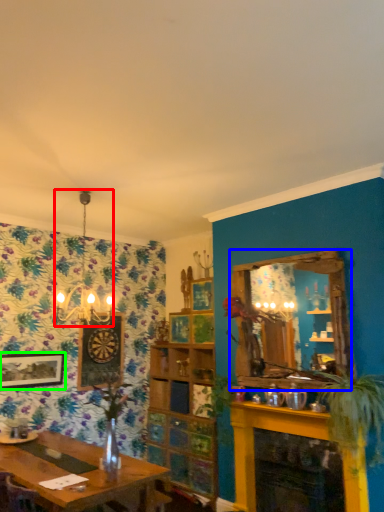
Question: Based on their relative distances, which object is nearer to light fixture (highlighted by a red box)? Choose from window (highlighted by a blue box) and picture frame (highlighted by a green box).

Choices:
 (A) window
 (B) picture frame

Answer: (B)